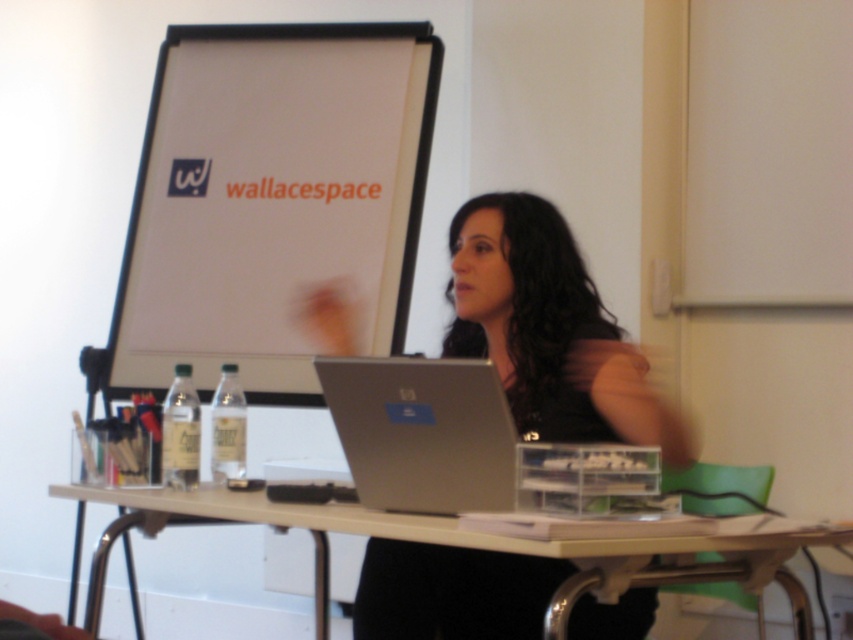
Question: Can you confirm if white matte projection screen at upper left is thinner than matte black laptop at center?

Choices:
 (A) no
 (B) yes

Answer: (A)

Question: Does white matte projection screen at upper left appear on the left side of white plastic table at center?

Choices:
 (A) yes
 (B) no

Answer: (A)

Question: In this image, where is silver metallic laptop at center located relative to white plastic table at center?

Choices:
 (A) left
 (B) right

Answer: (B)

Question: Among these points, which one is nearest to the camera?

Choices:
 (A) (274, 188)
 (B) (148, 513)
 (C) (590, 388)
 (D) (357, 467)

Answer: (D)

Question: Which point is farther from the camera taking this photo?

Choices:
 (A) (527, 419)
 (B) (302, 401)

Answer: (B)

Question: Which point appears closest to the camera in this image?

Choices:
 (A) (537, 502)
 (B) (474, 211)

Answer: (A)